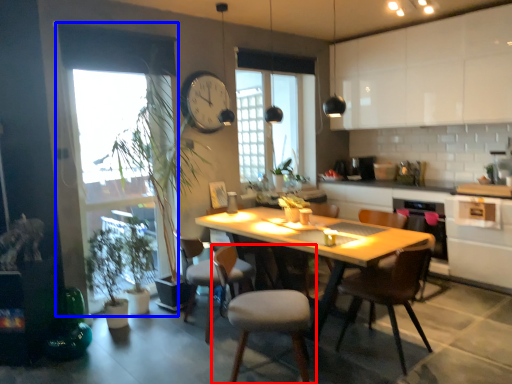
Question: Which object is closer to the camera taking this photo, chair (highlighted by a red box) or window screen (highlighted by a blue box)?

Choices:
 (A) chair
 (B) window screen

Answer: (A)